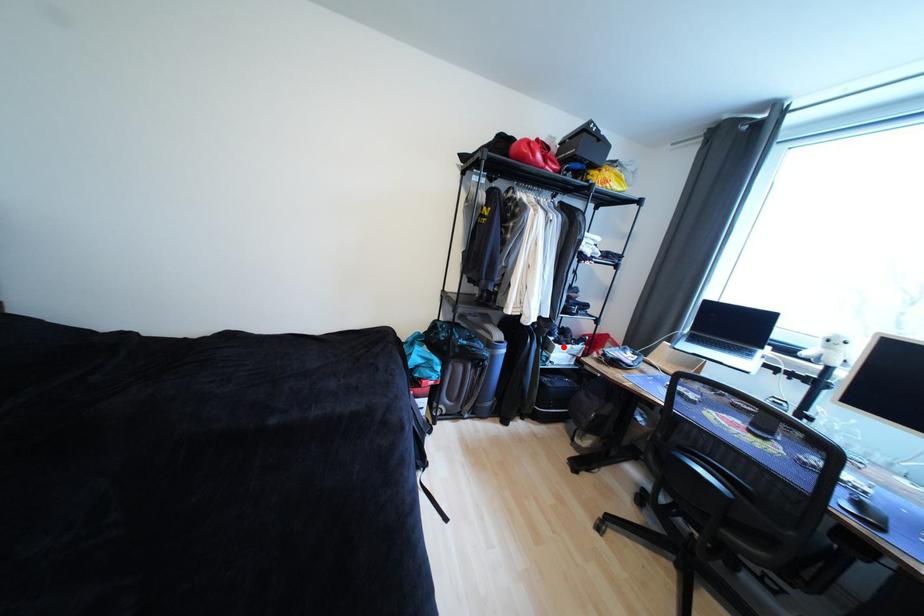
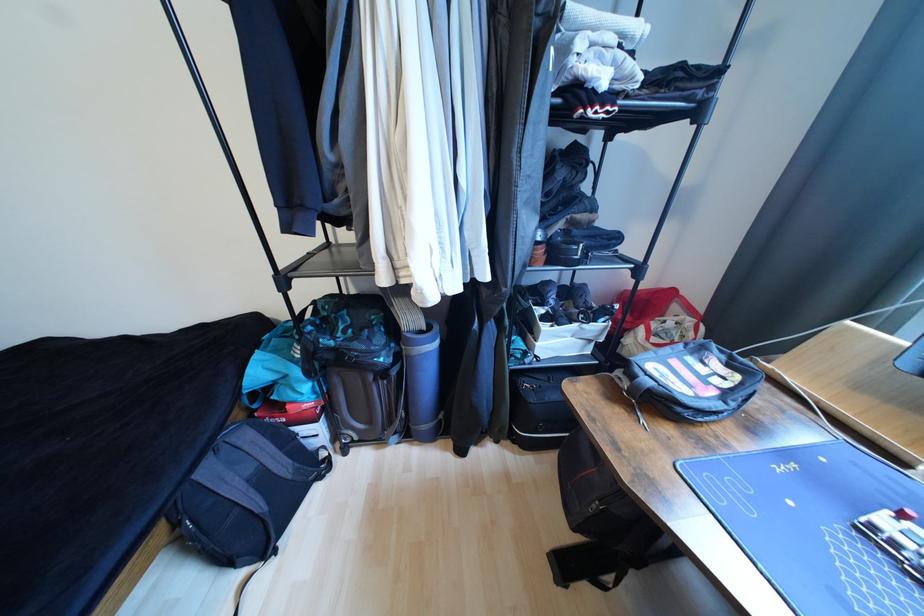
Locate, in the second image, the point that corresponds to the highlighted location in the first image.

(552, 329)